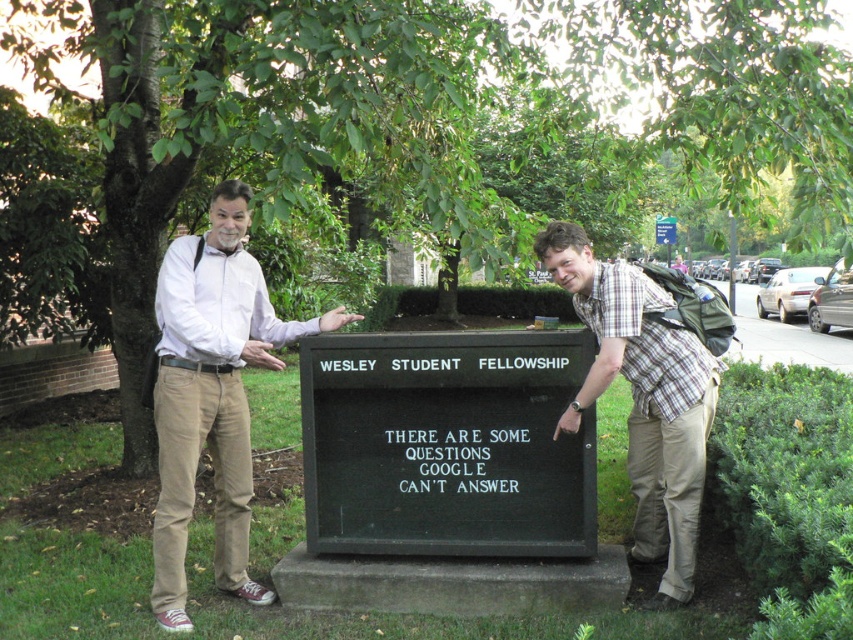
Question: Where is black matte sign at center located in relation to plaid shirt at right in the image?

Choices:
 (A) left
 (B) right

Answer: (A)

Question: Which of the following is the farthest from the observer?

Choices:
 (A) black matte sign at center
 (B) plaid shirt at right

Answer: (A)

Question: Does black matte sign at center have a greater width compared to plaid shirt at right?

Choices:
 (A) no
 (B) yes

Answer: (B)

Question: Which object is farther from the camera taking this photo?

Choices:
 (A) black matte sign at center
 (B) plaid shirt at right
 (C) light brown pants at left

Answer: (A)

Question: Does black matte sign at center appear under light brown pants at left?

Choices:
 (A) no
 (B) yes

Answer: (B)

Question: Which object is closer to the camera taking this photo?

Choices:
 (A) black matte sign at center
 (B) plaid shirt at right

Answer: (B)